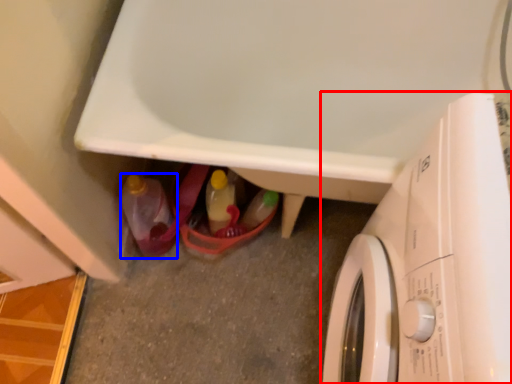
Question: Among these objects, which one is nearest to the camera, washing machine (highlighted by a red box) or bottle (highlighted by a blue box)?

Choices:
 (A) washing machine
 (B) bottle

Answer: (A)